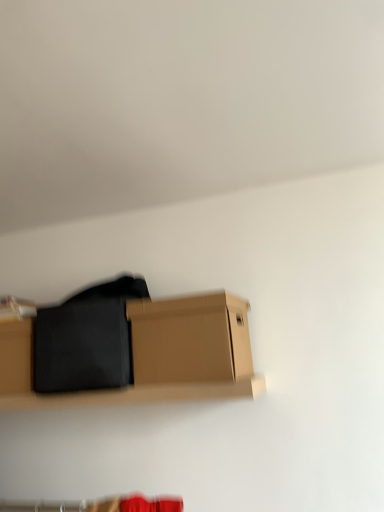
Image resolution: width=384 pixels, height=512 pixels. Describe the element at coordinates (86, 339) in the screenshot. I see `black matte fabric at center` at that location.

At what (x,y) coordinates should I click in order to perform the action: click on black matte fabric at center. Please return your answer as a coordinate pair (x, y). Image resolution: width=384 pixels, height=512 pixels. Looking at the image, I should click on (86, 339).

Measure the distance between black matte fabric at center and camera.

black matte fabric at center is 1.36 meters away from camera.

You are a GUI agent. You are given a task and a screenshot of the screen. Output one action in this format:
    pyautogui.click(x=<x>, y=<y>)
    Task: Click on the brown cardboard box at lower center
    This screenshot has height=512, width=384.
    Given the screenshot: What is the action you would take?
    pyautogui.click(x=190, y=339)

Describe the element at coordinates (190, 339) in the screenshot. The width and height of the screenshot is (384, 512). I see `brown cardboard box at lower center` at that location.

Where is `black matte fabric at center`? The image size is (384, 512). black matte fabric at center is located at coordinates (86, 339).

Considering the relative positions of black matte fabric at center and brown cardboard box at lower center in the image provided, is black matte fabric at center to the right of brown cardboard box at lower center from the viewer's perspective?

No, black matte fabric at center is not to the right of brown cardboard box at lower center.

Is black matte fabric at center in front of or behind brown cardboard box at lower center in the image?

Visually, black matte fabric at center is located behind brown cardboard box at lower center.

Which is in front, point (57, 310) or point (242, 318)?

Point (242, 318)

From the image's perspective, is black matte fabric at center positioned above or below brown cardboard box at lower center?

Based on their image positions, black matte fabric at center is located beneath brown cardboard box at lower center.

From a real-world perspective, is black matte fabric at center physically below brown cardboard box at lower center?

No, from a real-world perspective, black matte fabric at center is not beneath brown cardboard box at lower center.

Between black matte fabric at center and brown cardboard box at lower center, which one has larger width?

black matte fabric at center is wider.

From their relative heights in the image, would you say black matte fabric at center is taller or shorter than brown cardboard box at lower center?

Considering their sizes, black matte fabric at center has more height than brown cardboard box at lower center.

Considering the sizes of black matte fabric at center and brown cardboard box at lower center in the image, is black matte fabric at center bigger or smaller than brown cardboard box at lower center?

Considering their sizes, black matte fabric at center takes up more space than brown cardboard box at lower center.

Does black matte fabric at center contain brown cardboard box at lower center?

No, black matte fabric at center does not contain brown cardboard box at lower center.

Is there a large distance between black matte fabric at center and brown cardboard box at lower center?

They are positioned close to each other.

Is black matte fabric at center looking in the opposite direction of brown cardboard box at lower center?

That's not correct — black matte fabric at center is not looking away from brown cardboard box at lower center.

How distant is black matte fabric at center from brown cardboard box at lower center?

A distance of 6.78 inches exists between black matte fabric at center and brown cardboard box at lower center.

I want to click on box lying in front of the black matte fabric at center, so click(x=190, y=339).

Which object is positioned more to the right, brown cardboard box at lower center or black matte fabric at center?

brown cardboard box at lower center.

Which object is closer to the camera taking this photo, brown cardboard box at lower center or black matte fabric at center?

brown cardboard box at lower center is closer to the camera.

Which point is more forward, (198, 350) or (48, 346)?

Positioned in front is point (198, 350).

From the image's perspective, between brown cardboard box at lower center and black matte fabric at center, which one is located above?

brown cardboard box at lower center is shown above in the image.

From a real-world perspective, is brown cardboard box at lower center located beneath black matte fabric at center?

Correct, in the physical world, brown cardboard box at lower center is lower than black matte fabric at center.

Is brown cardboard box at lower center thinner than black matte fabric at center?

Yes, brown cardboard box at lower center is thinner than black matte fabric at center.

Considering the relative sizes of brown cardboard box at lower center and black matte fabric at center in the image provided, is brown cardboard box at lower center shorter than black matte fabric at center?

Correct, brown cardboard box at lower center is not as tall as black matte fabric at center.

Who is smaller, brown cardboard box at lower center or black matte fabric at center?

brown cardboard box at lower center.

Could black matte fabric at center be considered to be inside brown cardboard box at lower center?

Definitely not — black matte fabric at center is not inside brown cardboard box at lower center.

Would you consider brown cardboard box at lower center to be distant from black matte fabric at center?

No, brown cardboard box at lower center is not far away from black matte fabric at center.

Is brown cardboard box at lower center aimed at black matte fabric at center?

No.

Consider the image. Measure the distance between brown cardboard box at lower center and black matte fabric at center.

brown cardboard box at lower center and black matte fabric at center are 6.78 inches apart from each other.

Locate an element on the screen. This screenshot has height=512, width=384. box that is above the black matte fabric at center (from the image's perspective) is located at coordinates (190, 339).

You are a GUI agent. You are given a task and a screenshot of the screen. Output one action in this format:
    pyautogui.click(x=<x>, y=<y>)
    Task: Click on the clothing on the left of brown cardboard box at lower center
    The width and height of the screenshot is (384, 512).
    Given the screenshot: What is the action you would take?
    (x=86, y=339)

Where is `clothing above the brown cardboard box at lower center (from a real-world perspective)`? The width and height of the screenshot is (384, 512). clothing above the brown cardboard box at lower center (from a real-world perspective) is located at coordinates (86, 339).